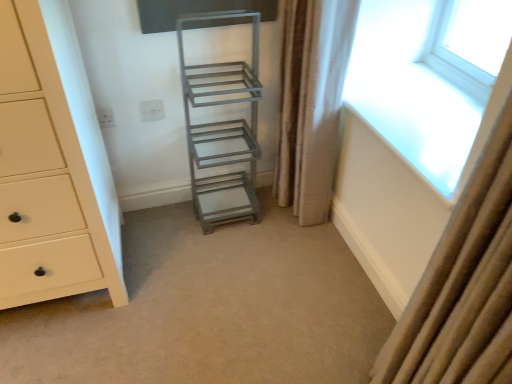
Question: Is beige textured curtain at right, marked as the second curtain in a front-to-back arrangement, outside of metallic gray ladder at center?

Choices:
 (A) yes
 (B) no

Answer: (A)

Question: From a real-world perspective, is beige textured curtain at right, the 1th curtain when ordered from back to front, beneath metallic gray ladder at center?

Choices:
 (A) no
 (B) yes

Answer: (A)

Question: Considering the relative positions of beige textured curtain at right, marked as the second curtain in a front-to-back arrangement, and metallic gray ladder at center in the image provided, is beige textured curtain at right, marked as the second curtain in a front-to-back arrangement, behind metallic gray ladder at center?

Choices:
 (A) no
 (B) yes

Answer: (B)

Question: From a real-world perspective, is beige textured curtain at right, marked as the second curtain in a front-to-back arrangement, on top of metallic gray ladder at center?

Choices:
 (A) no
 (B) yes

Answer: (B)

Question: Can you confirm if beige textured curtain at right, which is counted as the second curtain, starting from the right, is thinner than metallic gray ladder at center?

Choices:
 (A) no
 (B) yes

Answer: (B)

Question: Which is correct: metallic gray shelf at center is inside beige fabric curtain at right, the first curtain when ordered from front to back, or outside of it?

Choices:
 (A) inside
 (B) outside

Answer: (B)

Question: Is metallic gray shelf at center wider or thinner than beige fabric curtain at right, which appears as the second curtain when viewed from the left?

Choices:
 (A) wide
 (B) thin

Answer: (A)

Question: From a real-world perspective, is metallic gray shelf at center positioned above or below beige fabric curtain at right, the first curtain viewed from the right?

Choices:
 (A) above
 (B) below

Answer: (B)

Question: Is point (228, 74) closer or farther from the camera than point (413, 304)?

Choices:
 (A) farther
 (B) closer

Answer: (A)

Question: In terms of width, does matte cream chest of drawers at left look wider or thinner when compared to transparent glass window at upper right?

Choices:
 (A) wide
 (B) thin

Answer: (A)

Question: In terms of size, does matte cream chest of drawers at left appear bigger or smaller than transparent glass window at upper right?

Choices:
 (A) small
 (B) big

Answer: (B)

Question: Is matte cream chest of drawers at left spatially inside transparent glass window at upper right, or outside of it?

Choices:
 (A) inside
 (B) outside

Answer: (B)

Question: In terms of height, does matte cream chest of drawers at left look taller or shorter compared to transparent glass window at upper right?

Choices:
 (A) tall
 (B) short

Answer: (A)

Question: Based on their positions, is matte cream chest of drawers at left located to the left or right of metallic gray shelf at center?

Choices:
 (A) left
 (B) right

Answer: (A)

Question: Considering their positions, is matte cream chest of drawers at left located in front of or behind metallic gray shelf at center?

Choices:
 (A) front
 (B) behind

Answer: (A)